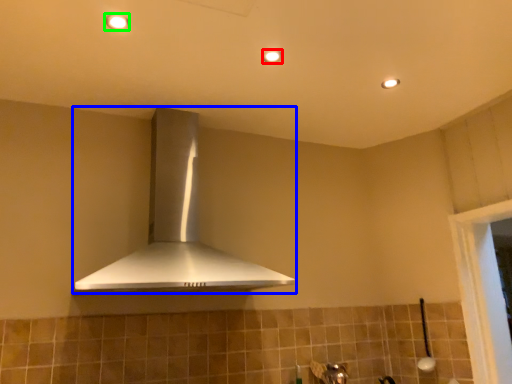
Question: Which is nearer to the light fixture (highlighted by a red box)? home appliance (highlighted by a blue box) or light fixture (highlighted by a green box).

Choices:
 (A) home appliance
 (B) light fixture

Answer: (B)